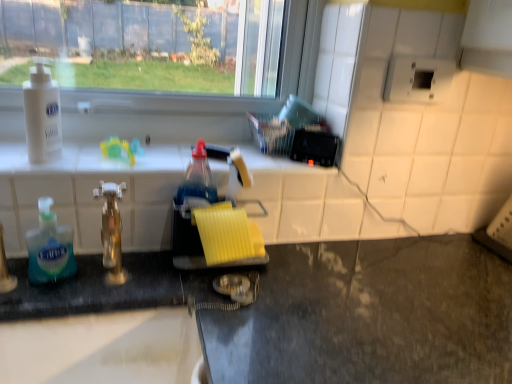
Where is `vacant space behind gold metallic faucet at center`? The width and height of the screenshot is (512, 384). vacant space behind gold metallic faucet at center is located at coordinates (138, 262).